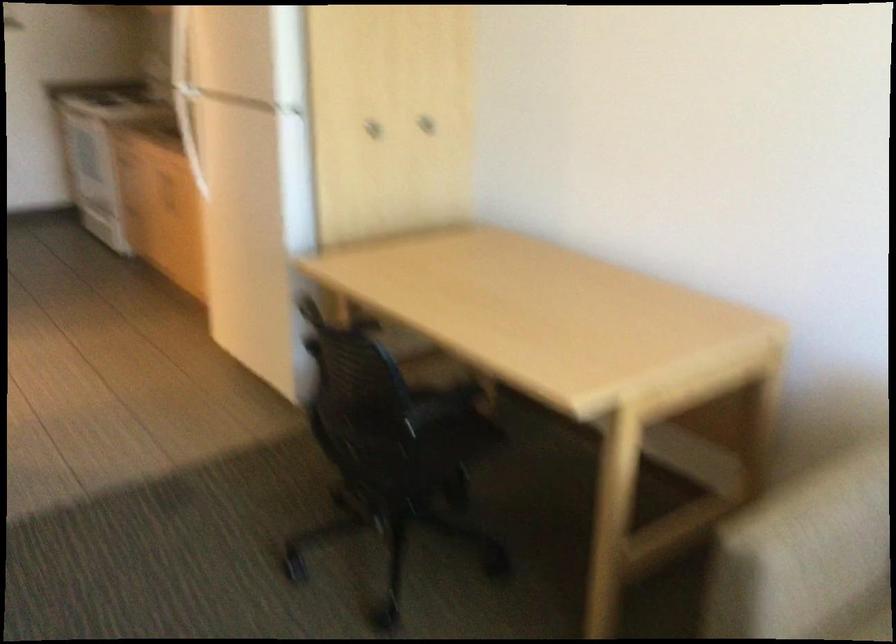
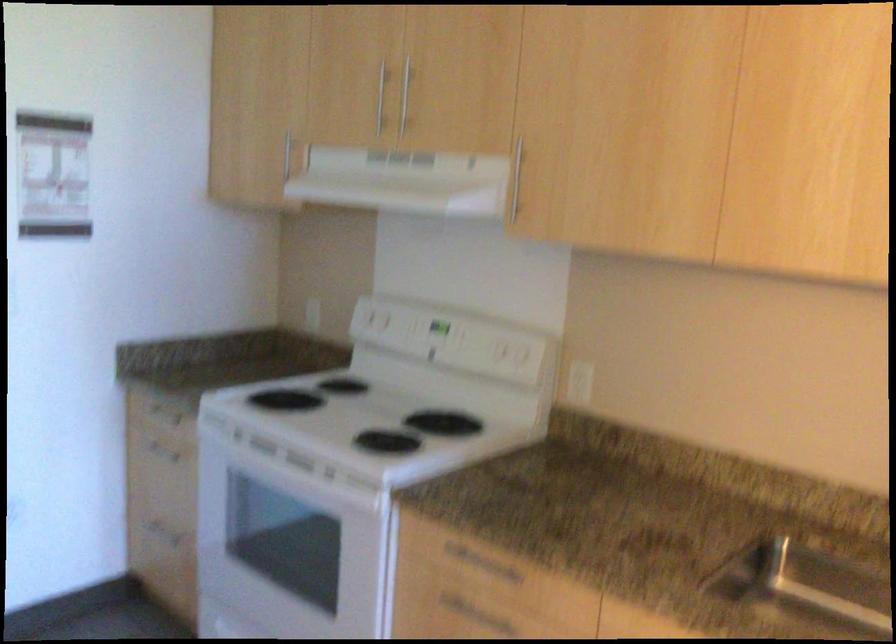
In a continuous first-person perspective shot, in which direction is the camera moving?

The cameraman walked toward left, forward.